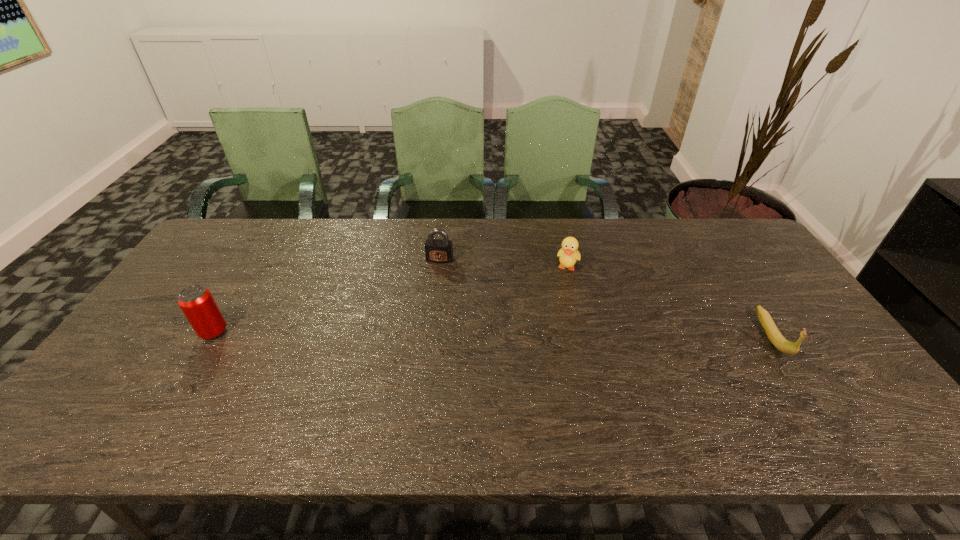
Image resolution: width=960 pixels, height=540 pixels. In order to click on the leftmost object in this screenshot , I will do `click(196, 302)`.

I want to click on can, so click(x=196, y=302).

The height and width of the screenshot is (540, 960). I want to click on banana, so click(x=772, y=332).

Find the location of a particular element. duckling is located at coordinates (568, 256).

Where is `padlock`? This screenshot has height=540, width=960. padlock is located at coordinates (436, 250).

Where is `vacant region located 0.390m on the right of the can`? This screenshot has height=540, width=960. vacant region located 0.390m on the right of the can is located at coordinates (372, 332).

Find the location of a particular element. vacant space located 0.050m at the stem of the rightmost object is located at coordinates (800, 379).

This screenshot has width=960, height=540. What are the coordinates of `vacant space located on the front-facing side of the duckling` in the screenshot? It's located at (547, 356).

Where is `blank space located 0.060m on the front-facing side of the duckling`? The image size is (960, 540). blank space located 0.060m on the front-facing side of the duckling is located at coordinates (564, 291).

This screenshot has height=540, width=960. I want to click on free region located on the front-facing side of the duckling, so click(x=562, y=299).